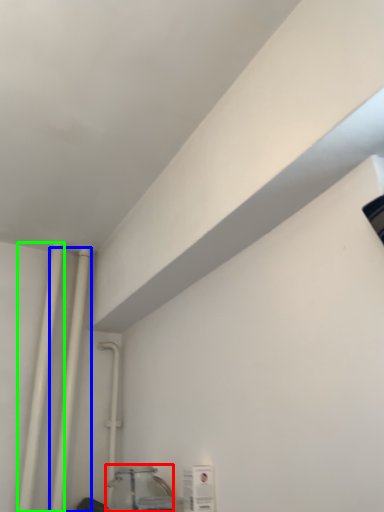
Question: Which is nearer to the glass jar (highlighted by a red box)? pipe (highlighted by a blue box) or pipe (highlighted by a green box).

Choices:
 (A) pipe
 (B) pipe

Answer: (A)